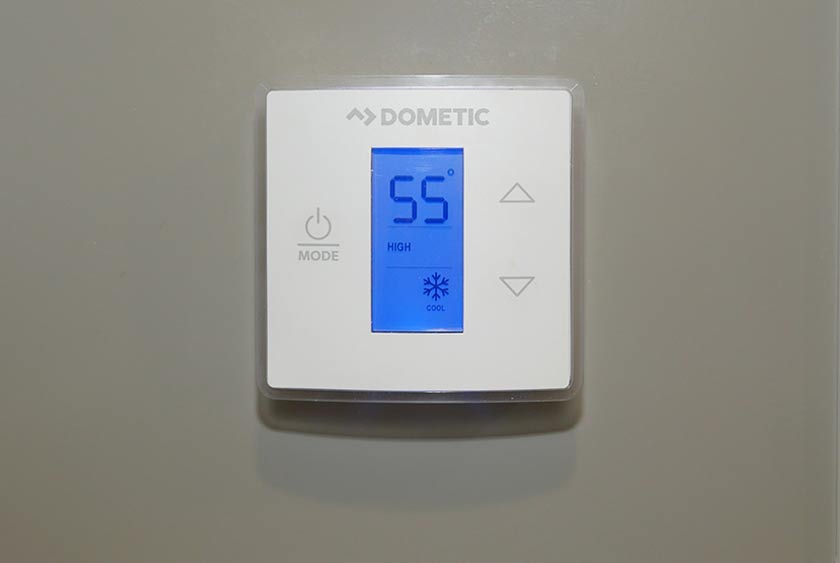
Where is `reading window`? This screenshot has width=840, height=563. reading window is located at coordinates (405, 294).